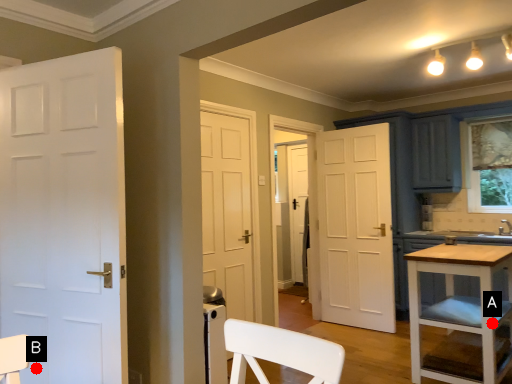
Question: Two points are circled on the image, labeled by A and B beside each circle. Which point appears closest to the camera in this image?

Choices:
 (A) A is closer
 (B) B is closer

Answer: (B)